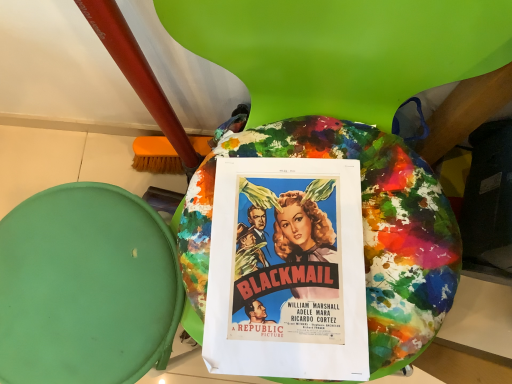
Describe the element at coordinates (287, 270) in the screenshot. I see `matte paper poster at center` at that location.

I want to click on matte paper poster at center, so click(x=287, y=270).

You are a GUI agent. You are given a task and a screenshot of the screen. Output one action in this format:
    pyautogui.click(x=<x>, y=<y>)
    Task: Click on the green fabric bean bag at lower left
    
    Given the screenshot: What is the action you would take?
    point(86,287)

What do you see at coordinates (86, 287) in the screenshot? I see `green fabric bean bag at lower left` at bounding box center [86, 287].

Find the location of a particular element. Image resolution: width=512 pixels, height=384 pixels. matte paper poster at center is located at coordinates (287, 270).

Between green fabric bean bag at lower left and matte paper poster at center, which one appears on the left side from the viewer's perspective?

Positioned to the left is green fabric bean bag at lower left.

In the image, is green fabric bean bag at lower left positioned in front of or behind matte paper poster at center?

Visually, green fabric bean bag at lower left is located behind matte paper poster at center.

Which is closer, (92, 265) or (286, 174)?

Point (286, 174)

From the image's perspective, is green fabric bean bag at lower left above or below matte paper poster at center?

From the image's perspective, green fabric bean bag at lower left appears below matte paper poster at center.

From a real-world perspective, which object rests below the other?

green fabric bean bag at lower left, from a real-world perspective.

Which of these two, green fabric bean bag at lower left or matte paper poster at center, is thinner?

matte paper poster at center.

Which of these two, green fabric bean bag at lower left or matte paper poster at center, stands taller?

green fabric bean bag at lower left.

Is green fabric bean bag at lower left bigger or smaller than matte paper poster at center?

Clearly, green fabric bean bag at lower left is larger in size than matte paper poster at center.

Based on the photo, is green fabric bean bag at lower left outside of matte paper poster at center?

Yes.

Is green fabric bean bag at lower left directly adjacent to matte paper poster at center?

No, green fabric bean bag at lower left is not beside matte paper poster at center.

Is green fabric bean bag at lower left looking in the opposite direction of matte paper poster at center?

green fabric bean bag at lower left is not turned away from matte paper poster at center.

Find the location of a particular element. The height and width of the screenshot is (384, 512). poster that is in front of the green fabric bean bag at lower left is located at coordinates (287, 270).

Visually, is matte paper poster at center positioned to the left or to the right of green fabric bean bag at lower left?

In the image, matte paper poster at center appears on the right side of green fabric bean bag at lower left.

Which is in front, matte paper poster at center or green fabric bean bag at lower left?

matte paper poster at center.

Between point (352, 247) and point (96, 188), which one is positioned in front?

Point (352, 247)

From the image's perspective, is matte paper poster at center beneath green fabric bean bag at lower left?

No, from the image's perspective, matte paper poster at center is not beneath green fabric bean bag at lower left.

From a real-world perspective, is matte paper poster at center physically above green fabric bean bag at lower left?

Correct, in the physical world, matte paper poster at center is higher than green fabric bean bag at lower left.

Does matte paper poster at center have a lesser width compared to green fabric bean bag at lower left?

Yes, matte paper poster at center is thinner than green fabric bean bag at lower left.

Does matte paper poster at center have a lesser height compared to green fabric bean bag at lower left?

Yes.

Between matte paper poster at center and green fabric bean bag at lower left, which one has larger size?

With larger size is green fabric bean bag at lower left.

Is matte paper poster at center surrounding green fabric bean bag at lower left?

No, green fabric bean bag at lower left is not a part of matte paper poster at center.

Does matte paper poster at center touch green fabric bean bag at lower left?

matte paper poster at center is not next to green fabric bean bag at lower left, and they're not touching.

Is matte paper poster at center positioned with its back to green fabric bean bag at lower left?

That's not correct — matte paper poster at center is not looking away from green fabric bean bag at lower left.

Measure the distance from matte paper poster at center to green fabric bean bag at lower left.

18.00 centimeters.

The image size is (512, 384). Identify the location of bean bag chair below the matte paper poster at center (from a real-world perspective). (86, 287).

Where is `bean bag chair to the left of matte paper poster at center`? The image size is (512, 384). bean bag chair to the left of matte paper poster at center is located at coordinates (86, 287).

Locate an element on the screen. Image resolution: width=512 pixels, height=384 pixels. poster positioned vertically above the green fabric bean bag at lower left (from a real-world perspective) is located at coordinates (287, 270).